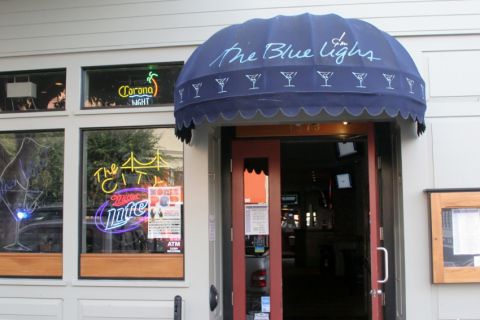
You are a GUI agent. You are given a task and a screenshot of the screen. Output one action in this format:
    pyautogui.click(x=<x>, y=<y>)
    Task: Click on the frame
    This screenshot has height=320, width=480.
    Given the screenshot: What is the action you would take?
    pyautogui.click(x=438, y=211)